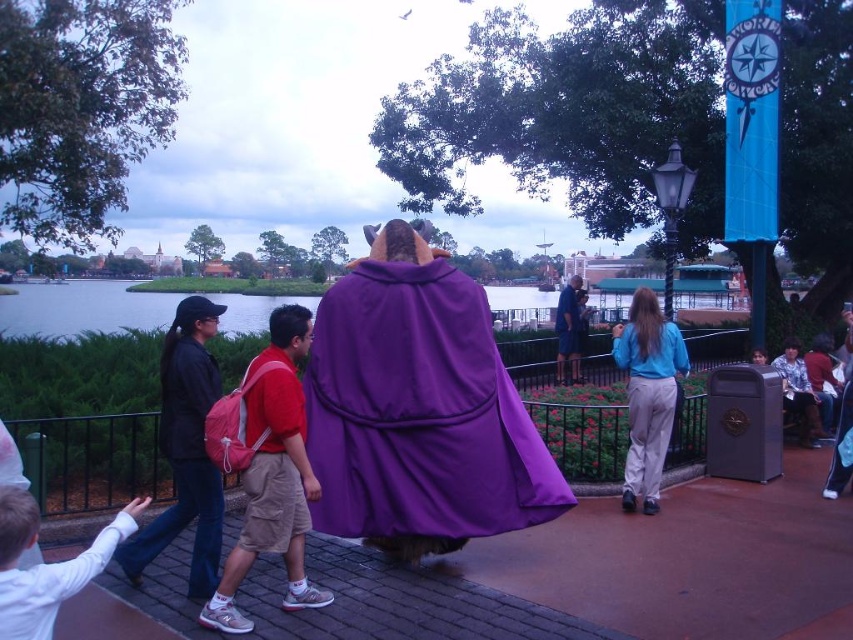
You are standing at the point marked by the coordinates point (267, 468), which is the location of the red backpack at center. You want to walk towards the black metal railing. Which direction should you head?

The red backpack at center is located at point (267, 468). To reach the black metal railing, you should head towards the edge of the paved walkway, as the railing is positioned along the border of the walkway in the scene.

You are standing at the center of the walkway and see the black fabric backpack at left. If you want to pick it up, which direction should you move towards?

The black fabric backpack at left is located at point (184, 451), so you should move towards the left side of the walkway to pick it up.